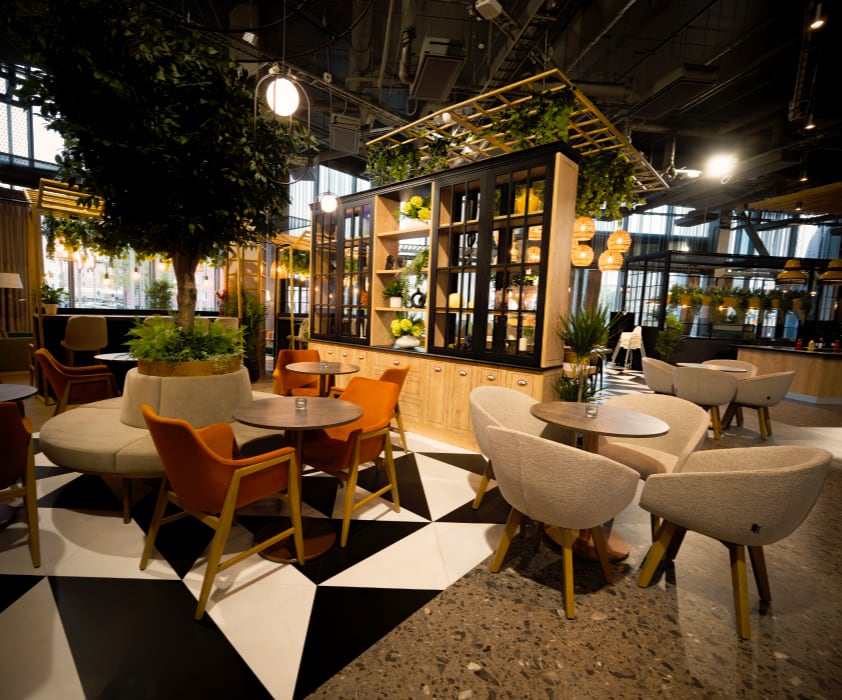
Where is `tables`? tables is located at coordinates (296, 405), (328, 358), (608, 414), (29, 386), (120, 351), (718, 367).